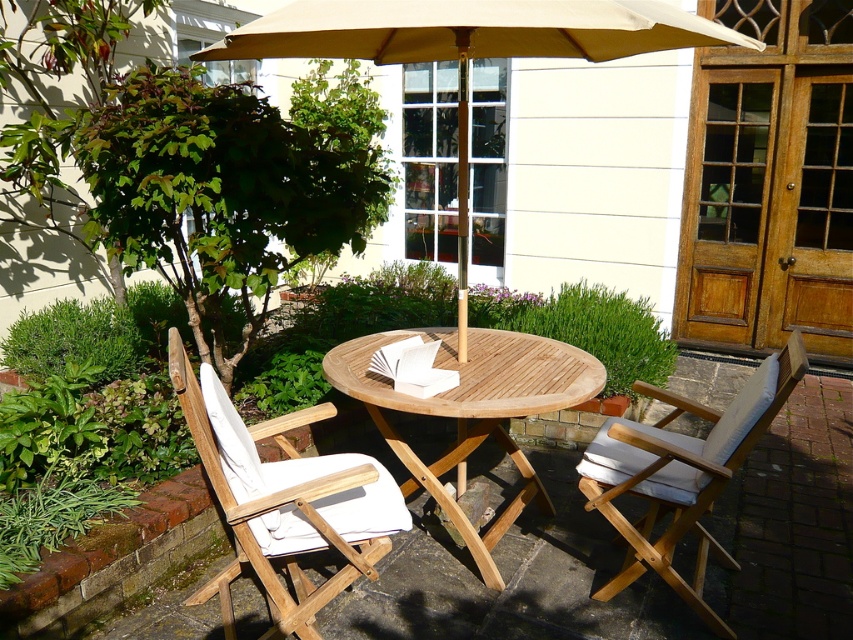
In the scene shown: Can you confirm if beige fabric umbrella at center is positioned to the left of teak wood chair at left?

No, beige fabric umbrella at center is not to the left of teak wood chair at left.

Which is in front, point (352, 45) or point (303, 496)?

Positioned in front is point (303, 496).

Where is `beige fabric umbrella at center`? beige fabric umbrella at center is located at coordinates (469, 49).

Locate an element on the screen. The height and width of the screenshot is (640, 853). beige fabric umbrella at center is located at coordinates (469, 49).

Is teak wood table at center bigger than white wood chair at right?

Yes, teak wood table at center is bigger than white wood chair at right.

What are the coordinates of `teak wood table at center` in the screenshot? It's located at (473, 410).

Who is positioned more to the right, teak wood chair at left or teak wood table at center?

teak wood table at center is more to the right.

Which is above, teak wood chair at left or teak wood table at center?

teak wood table at center

Where is `teak wood chair at left`? Image resolution: width=853 pixels, height=640 pixels. teak wood chair at left is located at coordinates (283, 500).